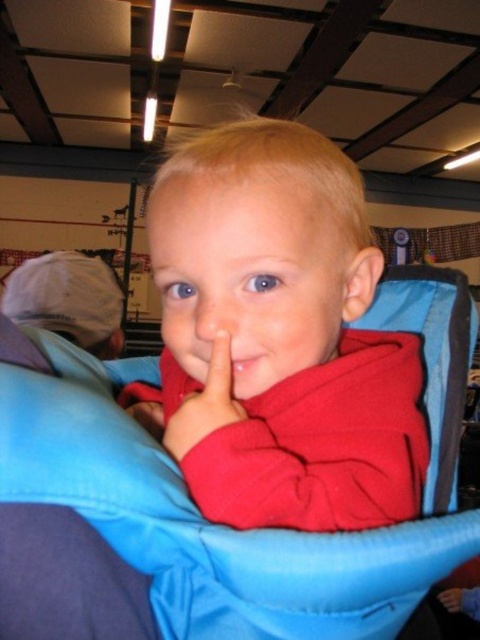
You are a photographer taking a picture of the scene. You notice a point at coordinates (278, 337) in the image. What object is located at that point?

The point at coordinates (278, 337) indicates the red fleece at center.

You are an interior designer planning to hang a small decorative item at point (278, 337). What is the color of the material at that location?

The point (278, 337) is on red fleece at center, so the color is red.

You are a photographer setting up for a photoshoot in a barn. You notice the red fleece at center and the white matte cap at upper left. Which object should you adjust your camera focus on first if you want to capture the smaller object clearly?

The red fleece at center is smaller than the white matte cap at upper left, so you should focus on the red fleece at center first to ensure its details are captured clearly.